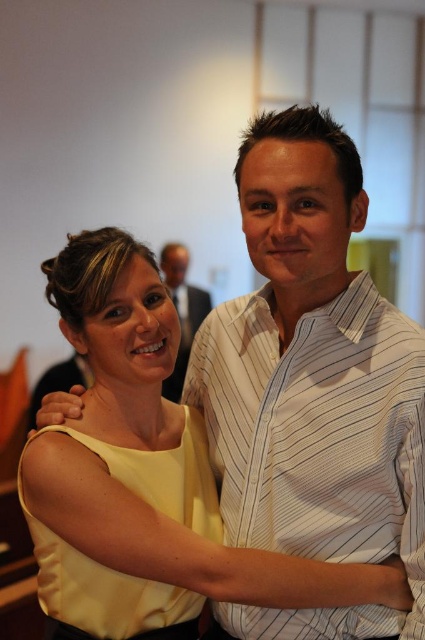
Question: Does white striped shirt at center have a smaller size compared to yellow satin dress at center?

Choices:
 (A) no
 (B) yes

Answer: (A)

Question: Among these points, which one is nearest to the camera?

Choices:
 (A) (82, 570)
 (B) (169, 289)
 (C) (260, 486)

Answer: (A)

Question: Can you confirm if white striped shirt at center is smaller than yellow satin dress at center?

Choices:
 (A) yes
 (B) no

Answer: (B)

Question: Estimate the real-world distances between objects in this image. Which object is farther from the white striped shirt at center?

Choices:
 (A) matte black suit at center
 (B) yellow satin dress at center

Answer: (A)

Question: Which is farther from the yellow satin dress at center?

Choices:
 (A) white striped shirt at center
 (B) matte black suit at center

Answer: (B)

Question: Does white striped shirt at center have a lesser width compared to yellow satin dress at center?

Choices:
 (A) no
 (B) yes

Answer: (A)